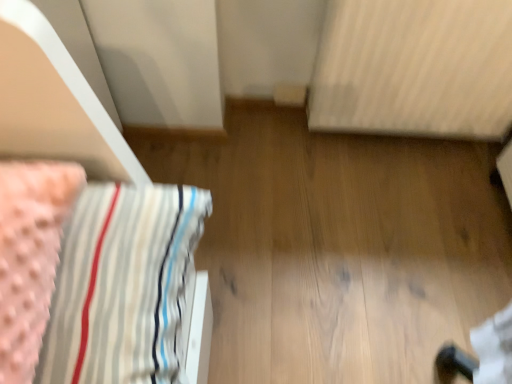
Identify the location of pink fabric at left. (95, 227).

The height and width of the screenshot is (384, 512). Describe the element at coordinates (95, 227) in the screenshot. I see `pink fabric at left` at that location.

What do you see at coordinates (414, 68) in the screenshot?
I see `white textured radiator at upper right` at bounding box center [414, 68].

At what (x,y) coordinates should I click in order to perform the action: click on white textured radiator at upper right. Please return your answer as a coordinate pair (x, y). This screenshot has height=384, width=512. Looking at the image, I should click on (414, 68).

What is the approximate width of white textured radiator at upper right?

It is 5.87 inches.

What are the coordinates of `pink fabric at left` in the screenshot? It's located at (95, 227).

Consider the image. Which is more to the left, white textured radiator at upper right or pink fabric at left?

pink fabric at left.

Based on the photo, considering the positions of objects white textured radiator at upper right and pink fabric at left in the image provided, who is behind, white textured radiator at upper right or pink fabric at left?

white textured radiator at upper right.

Is point (330, 75) in front of point (89, 217)?

No, it is behind (89, 217).

From the image's perspective, which object appears higher, white textured radiator at upper right or pink fabric at left?

From the image's view, white textured radiator at upper right is above.

From a real-world perspective, is white textured radiator at upper right below pink fabric at left?

Yes, from a real-world perspective, white textured radiator at upper right is under pink fabric at left.

Consider the image. Considering the sizes of white textured radiator at upper right and pink fabric at left in the image, is white textured radiator at upper right wider or thinner than pink fabric at left?

white textured radiator at upper right is thinner than pink fabric at left.

Is white textured radiator at upper right shorter than pink fabric at left?

No, white textured radiator at upper right is not shorter than pink fabric at left.

Does white textured radiator at upper right have a larger size compared to pink fabric at left?

Yes, white textured radiator at upper right is bigger than pink fabric at left.

Would you say white textured radiator at upper right contains pink fabric at left?

No, pink fabric at left is not surrounded by white textured radiator at upper right.

Is there a large distance between white textured radiator at upper right and pink fabric at left?

No, white textured radiator at upper right is not far from pink fabric at left.

Does white textured radiator at upper right turn towards pink fabric at left?

No, white textured radiator at upper right is not turned towards pink fabric at left.

Where is `radiator above the pink fabric at left (from the image's perspective)`? The image size is (512, 384). radiator above the pink fabric at left (from the image's perspective) is located at coordinates (414, 68).

Which object is positioned more to the right, pink fabric at left or white textured radiator at upper right?

white textured radiator at upper right.

Which object is closer to the camera, pink fabric at left or white textured radiator at upper right?

pink fabric at left is in front.

Does point (52, 49) lie in front of point (452, 4)?

Yes, it is in front of point (452, 4).

From the image's perspective, which is below, pink fabric at left or white textured radiator at upper right?

pink fabric at left appears lower in the image.

From a real-world perspective, who is located lower, pink fabric at left or white textured radiator at upper right?

white textured radiator at upper right, from a real-world perspective.

Looking at this image, is pink fabric at left thinner than white textured radiator at upper right?

In fact, pink fabric at left might be wider than white textured radiator at upper right.

Is pink fabric at left shorter than white textured radiator at upper right?

Yes.

Is pink fabric at left bigger or smaller than white textured radiator at upper right?

pink fabric at left is smaller than white textured radiator at upper right.

Is pink fabric at left completely or partially outside of white textured radiator at upper right?

Yes, pink fabric at left is located beyond the bounds of white textured radiator at upper right.

Can you see pink fabric at left touching white textured radiator at upper right?

No, pink fabric at left is not beside white textured radiator at upper right.

Could you tell me if pink fabric at left is facing white textured radiator at upper right?

No, pink fabric at left is not oriented towards white textured radiator at upper right.

Measure the distance between pink fabric at left and white textured radiator at upper right.

The distance of pink fabric at left from white textured radiator at upper right is 31.88 inches.

Image resolution: width=512 pixels, height=384 pixels. I want to click on radiator behind the pink fabric at left, so point(414,68).

This screenshot has width=512, height=384. I want to click on radiator on the right of the pink fabric at left, so click(414, 68).

Where is `furniture in front of the white textured radiator at upper right`? This screenshot has height=384, width=512. furniture in front of the white textured radiator at upper right is located at coordinates (95, 227).